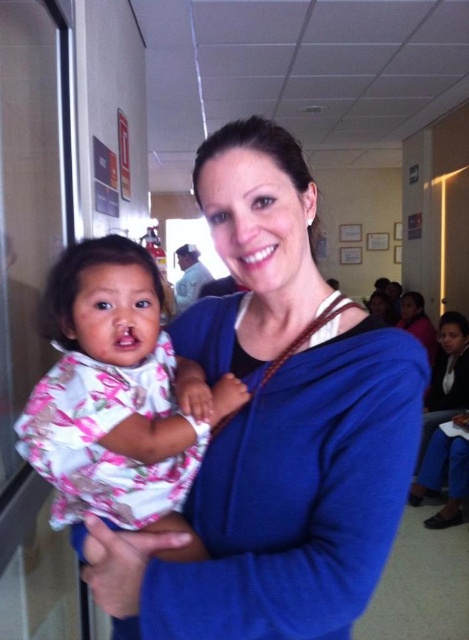
Does blue zip-up sweater at center have a larger size compared to matte blue sweater at center?

Actually, blue zip-up sweater at center might be smaller than matte blue sweater at center.

Is point (213, 577) closer to camera compared to point (414, 308)?

That is True.

Where is `blue zip-up sweater at center`? The width and height of the screenshot is (469, 640). blue zip-up sweater at center is located at coordinates (282, 500).

Which is in front, point (52, 401) or point (420, 328)?

Point (52, 401) is more forward.

Find the location of a particular element. The width and height of the screenshot is (469, 640). floral fabric baby at left is located at coordinates click(x=111, y=396).

Is blue zip-up sweater at center in front of floral fabric baby at left?

Yes, blue zip-up sweater at center is in front of floral fabric baby at left.

Is blue zip-up sweater at center above floral fabric baby at left?

Actually, blue zip-up sweater at center is below floral fabric baby at left.

The height and width of the screenshot is (640, 469). I want to click on blue zip-up sweater at center, so click(282, 500).